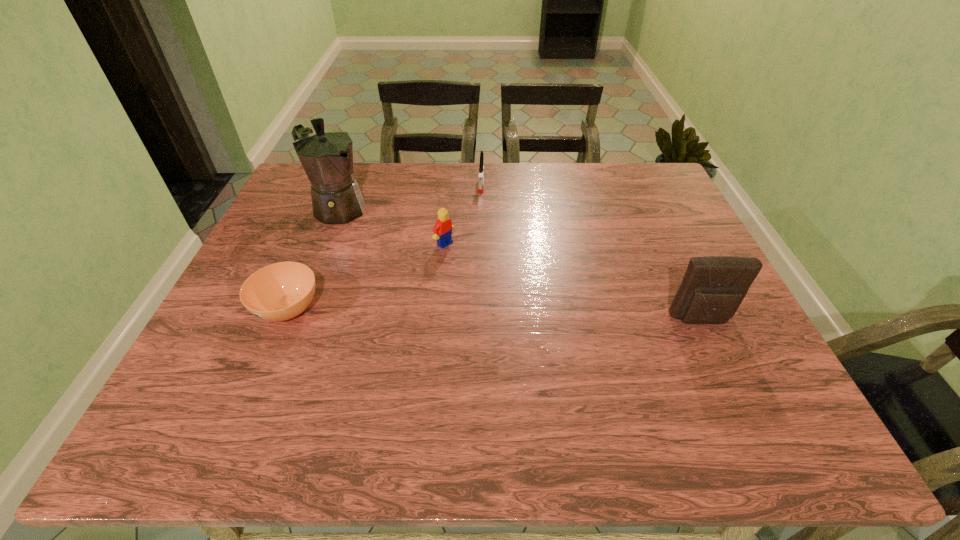
Identify the location of free space on the desktop that is between the soup bowl and the rightmost object and is positioned on the pouring side of the tallest object. The height and width of the screenshot is (540, 960). [502, 314].

At what (x,y) coordinates should I click in order to perform the action: click on free spot on the desktop that is between the shortest object and the fourth shortest object and is positioned on the face of the third nearest object. Please return your answer as a coordinate pair (x, y). Looking at the image, I should click on (551, 316).

This screenshot has width=960, height=540. What are the coordinates of `free space on the desktop that is between the soup bowl and the fourth shortest object and is positioned on the handle side of the fourth tallest object` in the screenshot? It's located at (467, 314).